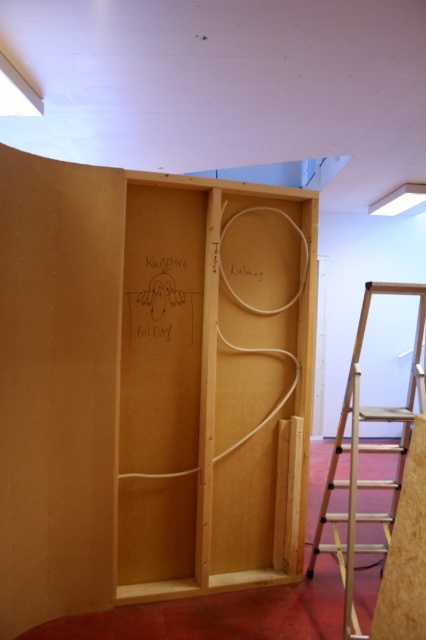
Between natural wood plywood at center and wooden step ladder at right, which one appears on the right side from the viewer's perspective?

wooden step ladder at right is more to the right.

Between natural wood plywood at center and wooden step ladder at right, which one has more height?

natural wood plywood at center is taller.

Who is more distant from viewer, (213, 332) or (324, 520)?

Positioned behind is point (324, 520).

Where is `natural wood plywood at center`? The width and height of the screenshot is (426, 640). natural wood plywood at center is located at coordinates (147, 387).